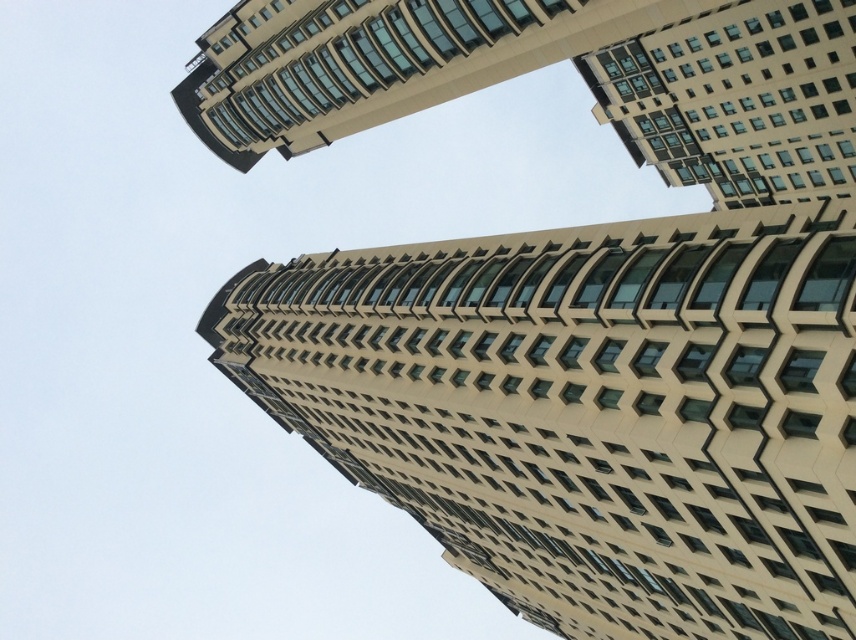
You are an architect analyzing the structure of the beige concrete building at center and the beige glass building at upper center. Which one has a greater height?

The beige concrete building at center is taller than the beige glass building at upper center.

You are an architect evaluating the design of a modern building complex. You notice the beige concrete building at center and the beige glass building at upper center. Which building has a narrower structure?

The beige concrete building at center has a lesser width compared to the beige glass building at upper center, so it is narrower.

You are standing in front of a modern architectural structure. You see the beige concrete building at center and the beige glass building at upper center. Which one is closer to you?

The beige concrete building at center is closer to the viewer than the beige glass building at upper center.